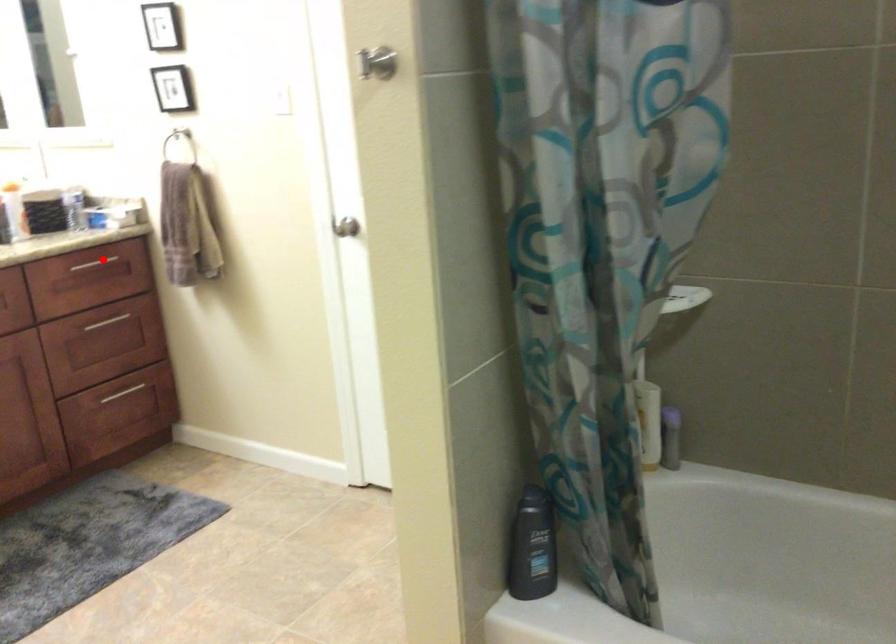
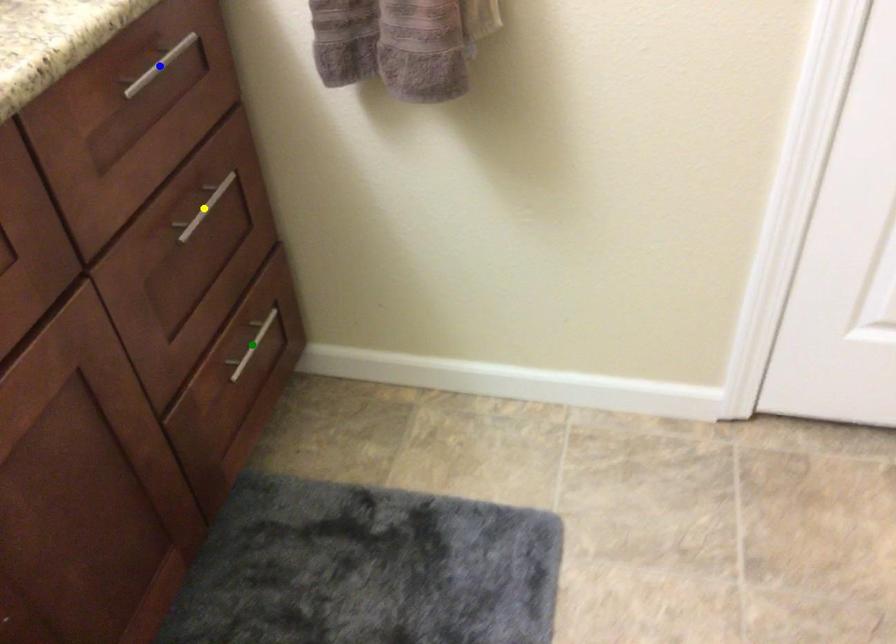
Question: I am providing you with two images of the same scene from different viewpoints. A red point is marked on the first image. You are given multiple points on the second image. Which point in image 2 represents the same 3d spot as the red point in image 1?

Choices:
 (A) yellow point
 (B) blue point
 (C) green point

Answer: (B)